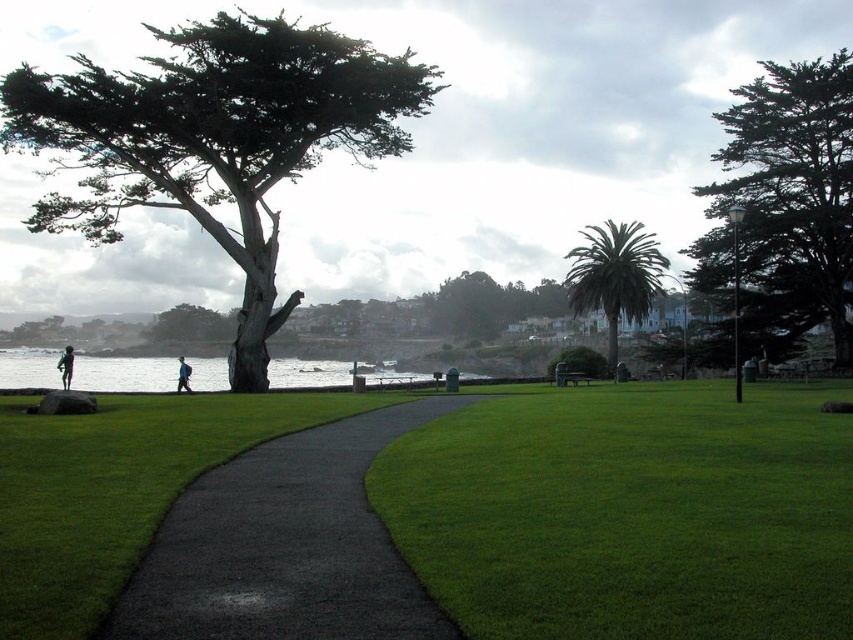
Question: Considering the relative positions of green textured tree at right and smooth gray bark tree at center in the image provided, where is green textured tree at right located with respect to smooth gray bark tree at center?

Choices:
 (A) above
 (B) below

Answer: (A)

Question: Considering the relative positions of green textured tree at right and blue fabric backpack at lower center in the image provided, where is green textured tree at right located with respect to blue fabric backpack at lower center?

Choices:
 (A) below
 (B) above

Answer: (B)

Question: Which is farther from the green grass at center?

Choices:
 (A) green leafy palm tree at center
 (B) blue fabric backpack at lower center
 (C) black asphalt path at center

Answer: (A)

Question: Is black asphalt path at center in front of smooth gray bark tree at center?

Choices:
 (A) no
 (B) yes

Answer: (B)

Question: Which of the following is the farthest from the observer?

Choices:
 (A) green leafy palm tree at center
 (B) black asphalt path at center
 (C) smooth gray bark tree at center

Answer: (C)

Question: Among these objects, which one is farthest from the camera?

Choices:
 (A) green textured tree at left
 (B) green grass at center

Answer: (A)